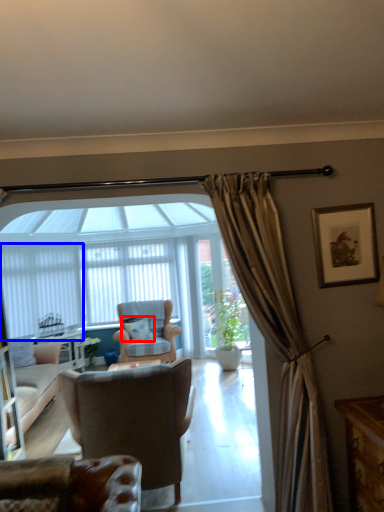
Question: Which point is closer to the camera, pillow (highlighted by a red box) or curtain (highlighted by a blue box)?

Choices:
 (A) pillow
 (B) curtain

Answer: (B)